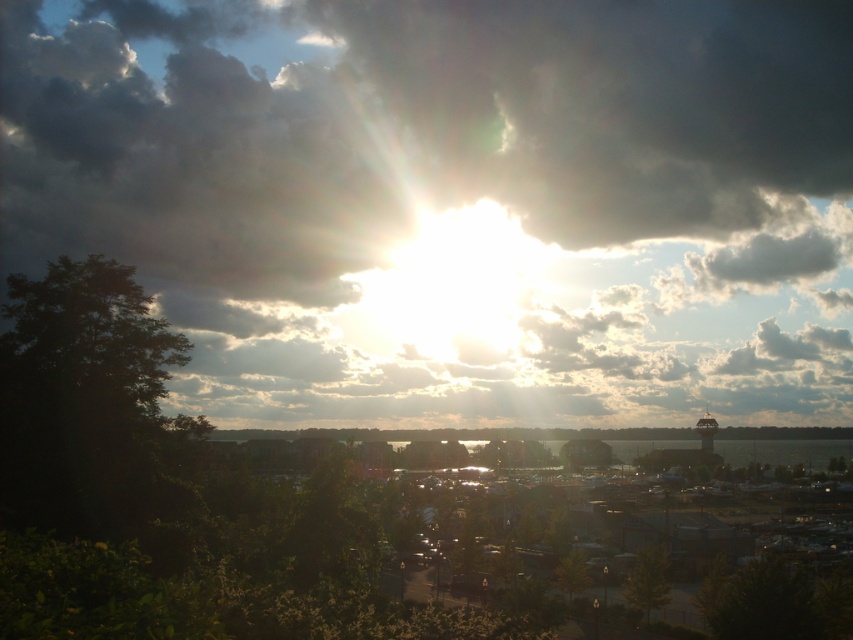
Question: Among these objects, which one is farthest from the camera?

Choices:
 (A) cloudy at upper center
 (B) green matte tree at lower center
 (C) green matte tree at lower right

Answer: (B)

Question: Which object is farther from the camera taking this photo?

Choices:
 (A) dark green leafy tree at left
 (B) green matte tree at lower center
 (C) green leafy tree at lower right

Answer: (B)

Question: Is cloudy at upper center below green leafy tree at lower right?

Choices:
 (A) no
 (B) yes

Answer: (A)

Question: Among these objects, which one is farthest from the camera?

Choices:
 (A) green leafy tree at lower right
 (B) dark green leafy tree at left
 (C) cloudy at upper center

Answer: (A)

Question: Can you confirm if cloudy at upper center is smaller than green matte tree at lower right?

Choices:
 (A) yes
 (B) no

Answer: (B)

Question: Is dark green leafy tree at left closer to the viewer compared to green leafy tree at lower right?

Choices:
 (A) yes
 (B) no

Answer: (A)